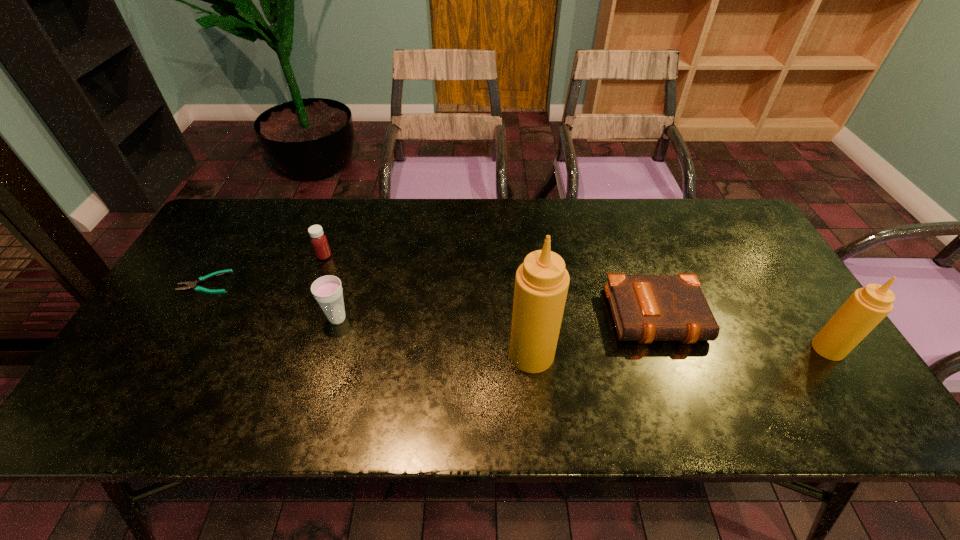
Please point a vacant point for placing a condiment on the left. Please provide its 2D coordinates. Your answer should be formatted as a tuple, i.e. [(x, y)], where the tuple contains the x and y coordinates of a point satisfying the conditions above.

[(228, 360)]